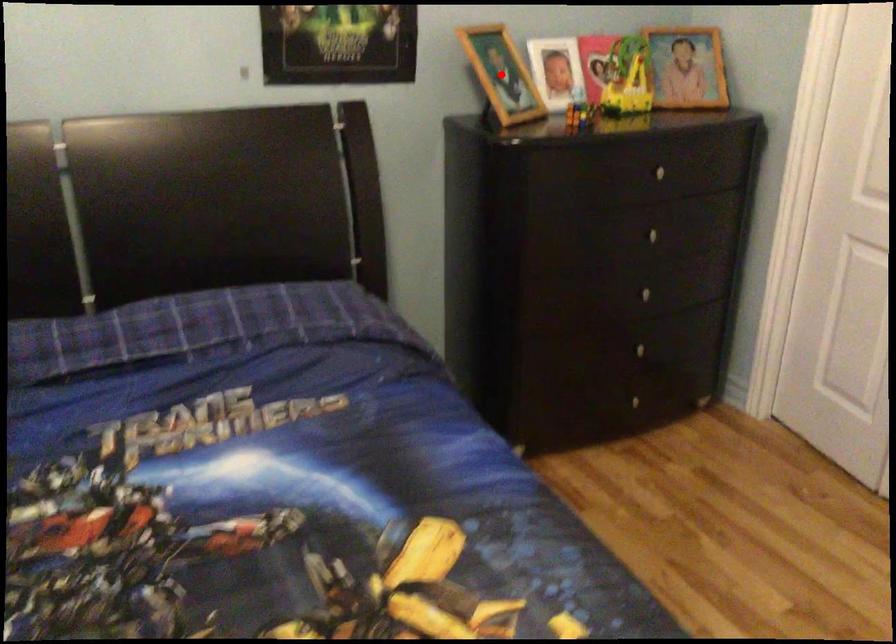
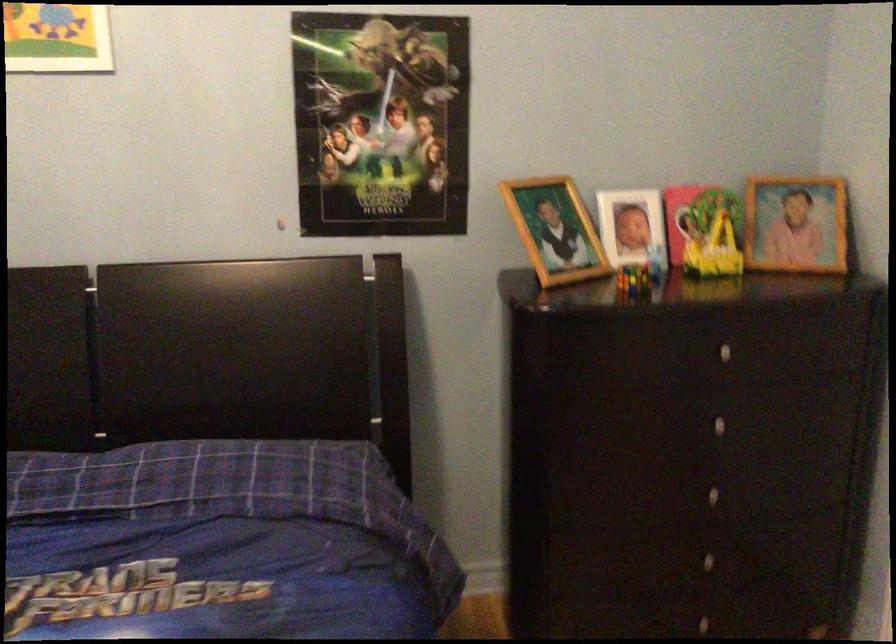
Question: I am providing you with two images of the same scene from different viewpoints. A red point is shown in image1. For the corresponding object point in image2, is it positioned nearer or farther from the camera?

Choices:
 (A) Nearer
 (B) Farther

Answer: (A)